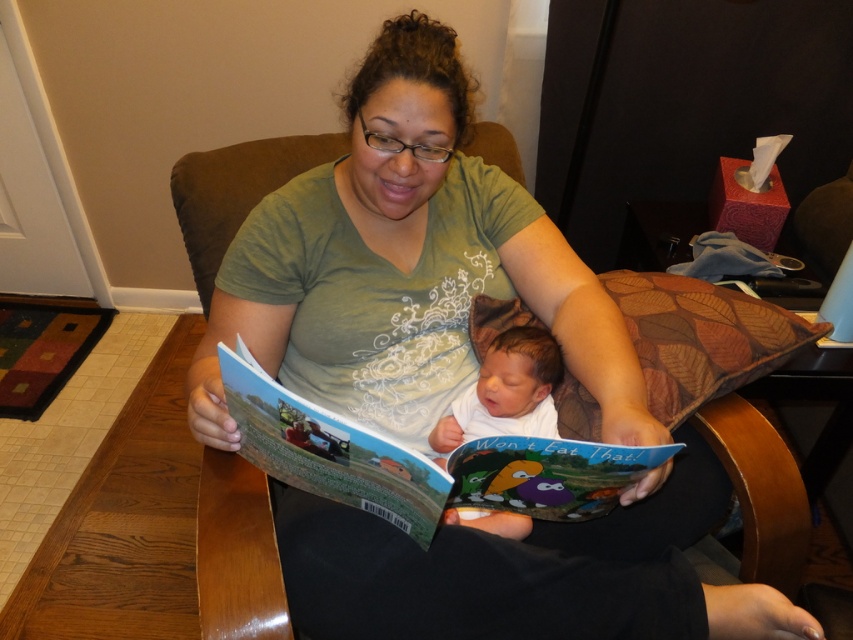
You are a fashion designer observing the scene. You need to decide which item, the green matte shirt at center or the soft white skin at center, has a larger surface area in the image. Based on the description, which one do you think is wider?

The green matte shirt at center might be wider than soft white skin at center according to the description.

You are a parent holding your baby and a book. The baby is on your lap, and the book is in your hand. According to the scene, where is the hardcover book at center relative to the soft white skin at center?

The hardcover book at center is positioned under the soft white skin at center, meaning the book is beneath the baby.